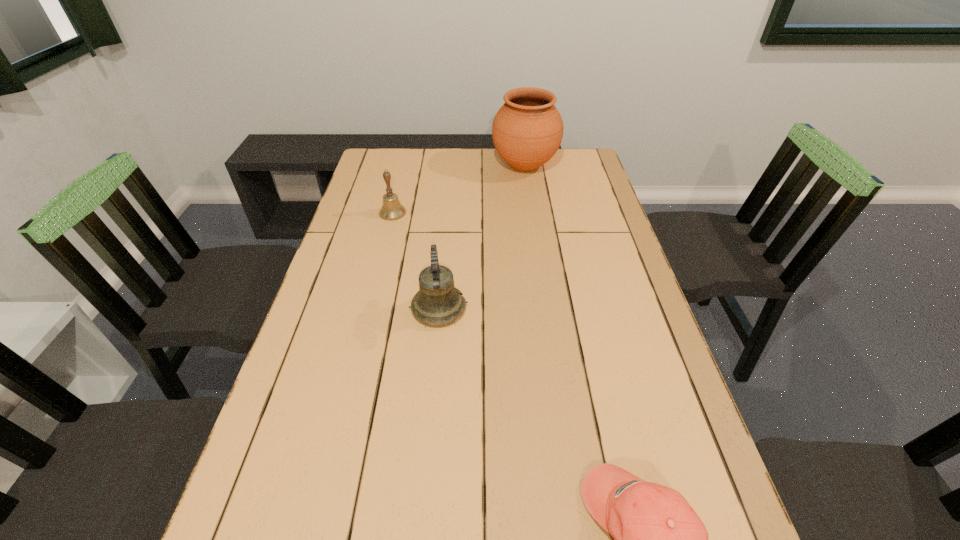
I want to click on pottery, so click(x=527, y=131).

The image size is (960, 540). Find the location of `the tallest object`. the tallest object is located at coordinates 527,131.

This screenshot has width=960, height=540. Find the location of `the nearer bell`. the nearer bell is located at coordinates (438, 302).

Find the location of `the third farthest object`. the third farthest object is located at coordinates (438, 302).

Where is `the left bell`? Image resolution: width=960 pixels, height=540 pixels. the left bell is located at coordinates (391, 209).

Identify the location of the farther bell. (391, 209).

Find the location of a particular element. The image size is (960, 540). free spot located 0.070m on the left of the farthest object is located at coordinates (473, 165).

Identify the location of free space located on the back of the right bell. click(x=444, y=246).

Where is `vacant area situated 0.400m on the front of the left bell`? vacant area situated 0.400m on the front of the left bell is located at coordinates (368, 312).

Locate an element on the screen. The image size is (960, 540). object situated at the far edge is located at coordinates (527, 131).